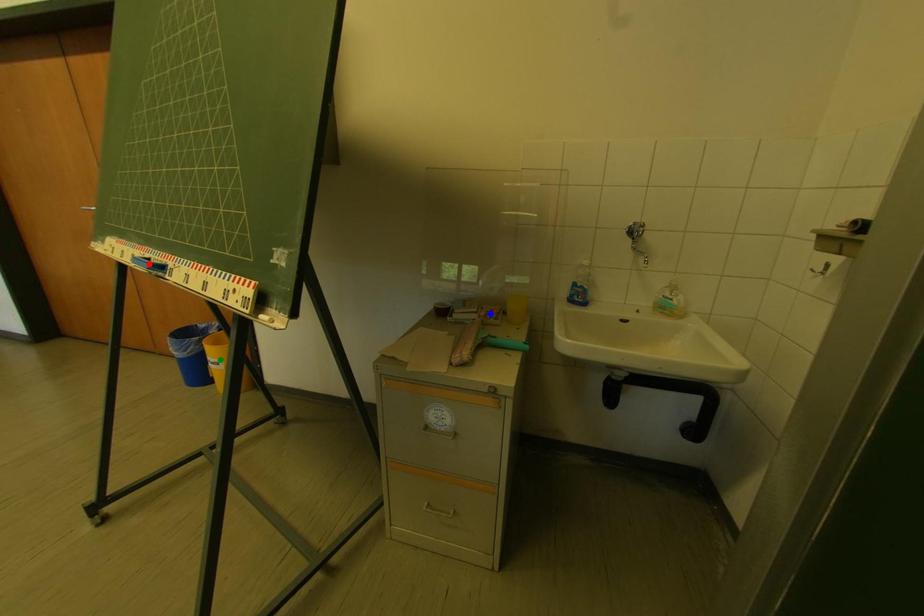
Order these from farthest to nearest:
red point | blue point | green point

1. green point
2. blue point
3. red point